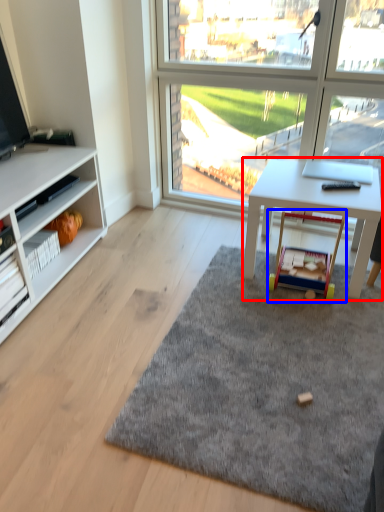
Question: Which object appears farthest to the camera in this image, desk (highlighted by a red box) or toy (highlighted by a blue box)?

Choices:
 (A) desk
 (B) toy

Answer: (B)